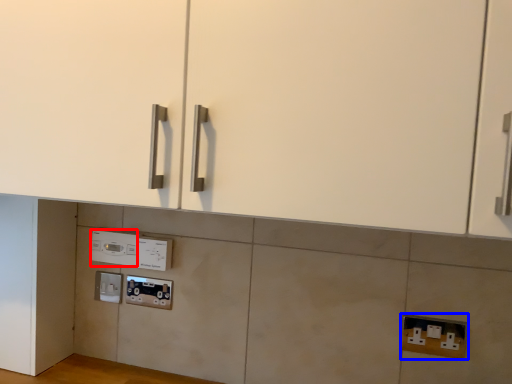
Question: Which of the following is the farthest to the observer, appliance (highlighted by a red box) or electric outlet (highlighted by a blue box)?

Choices:
 (A) appliance
 (B) electric outlet

Answer: (A)